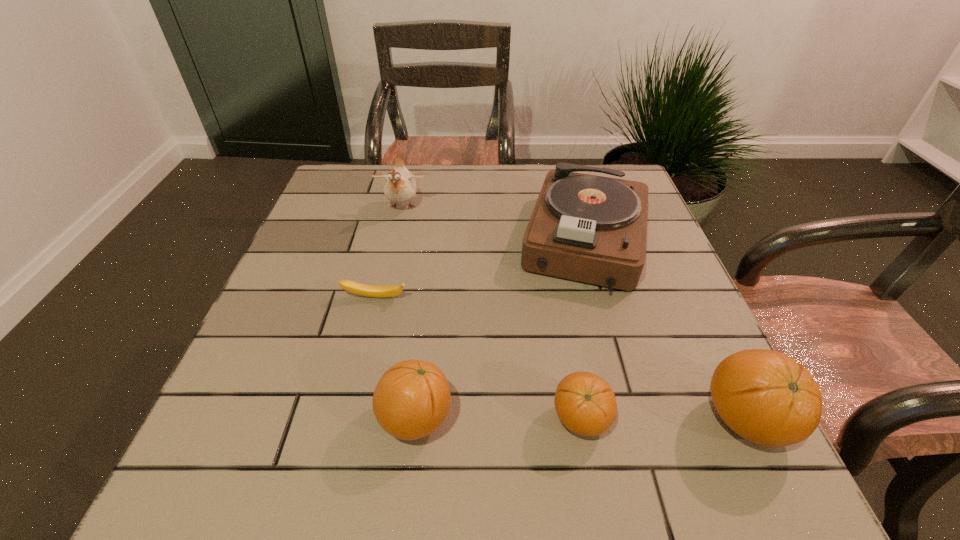
Identify the location of blank region between the rightmost orange and the fifth tallest object. (663, 420).

The height and width of the screenshot is (540, 960). What are the coordinates of `empty location between the bird and the tallest orange` in the screenshot? It's located at (x=574, y=314).

The height and width of the screenshot is (540, 960). Identify the location of free point between the shortest orange and the second tallest orange. (498, 418).

What are the coordinates of `vacant area that lies between the second shortest orange and the bird` in the screenshot? It's located at (409, 313).

Where is `blank region between the tallest orange and the shortest object`? blank region between the tallest orange and the shortest object is located at coordinates (561, 359).

Identify the location of free area in between the shortest orange and the banana. (478, 358).

Image resolution: width=960 pixels, height=540 pixels. What are the coordinates of `free space between the shortest orange and the rightmost orange` in the screenshot? It's located at pyautogui.click(x=663, y=420).

Locate an element on the screen. The height and width of the screenshot is (540, 960). object that is the closest to the fifth tallest object is located at coordinates (766, 397).

Find the location of a particular element. This screenshot has width=960, height=540. the fourth closest object to the bird is located at coordinates (586, 405).

Locate an element on the screen. The width and height of the screenshot is (960, 540). orange identified as the closest to the record player is located at coordinates (766, 397).